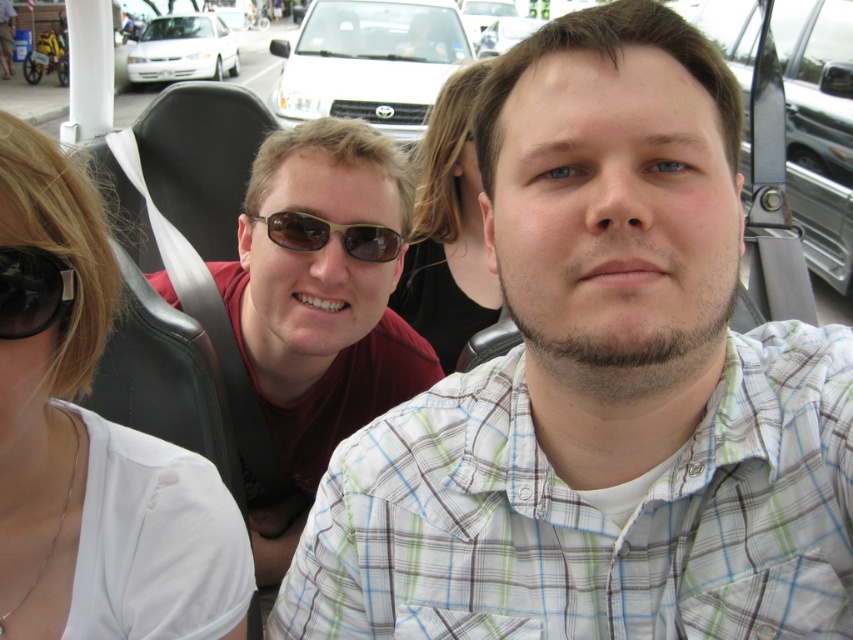
How much distance is there between white fabric shirt at left and black plastic goggles at upper left?

They are 7.20 inches apart.

Does white fabric shirt at left appear on the right side of black plastic goggles at upper left?

Incorrect, white fabric shirt at left is not on the right side of black plastic goggles at upper left.

Is point (50, 362) positioned in front of point (56, 276)?

No, it is behind (56, 276).

Where is `white fabric shirt at left`? white fabric shirt at left is located at coordinates (45, 376).

Between white plaid shirt at center and white matte car at upper center, which one has less height?

Standing shorter between the two is white plaid shirt at center.

Is white plaid shirt at center closer to the viewer compared to white matte car at upper center?

Yes, it is.

Between point (538, 161) and point (332, 1), which one is positioned behind?

The point (332, 1) is behind.

Find the location of a particular element. This screenshot has height=640, width=853. white plaid shirt at center is located at coordinates (601, 388).

Does white fabric shirt at left appear on the left side of silver metallic car at right?

Yes, white fabric shirt at left is to the left of silver metallic car at right.

Consider the image. Is white fabric shirt at left to the right of silver metallic car at right from the viewer's perspective?

No, white fabric shirt at left is not to the right of silver metallic car at right.

Does point (189, 492) come farther from viewer compared to point (842, 113)?

No, it is not.

Where is `white fabric shirt at left`? This screenshot has height=640, width=853. white fabric shirt at left is located at coordinates (45, 376).